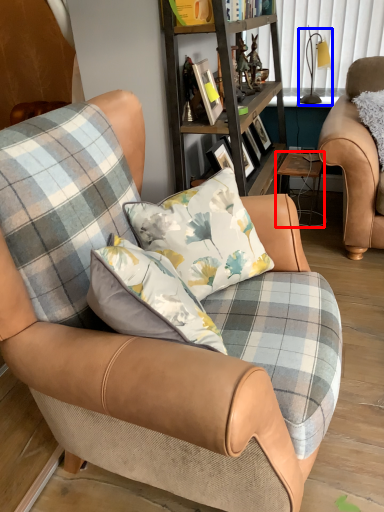
Question: Which object is further to the camera taking this photo, table (highlighted by a red box) or lamp (highlighted by a blue box)?

Choices:
 (A) table
 (B) lamp

Answer: (B)